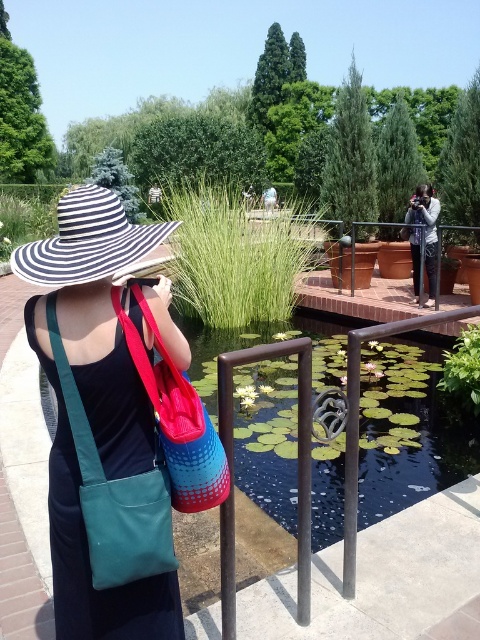
Looking at this image, can you confirm if matte blue bag at center is smaller than matte black camera at center?

Indeed, matte blue bag at center has a smaller size compared to matte black camera at center.

Image resolution: width=480 pixels, height=640 pixels. I want to click on matte blue bag at center, so [x=96, y=406].